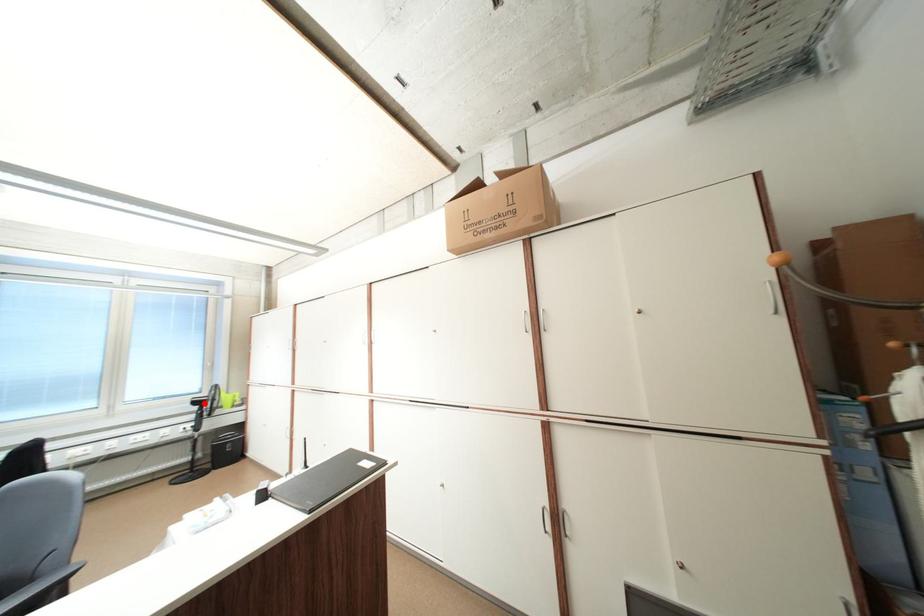
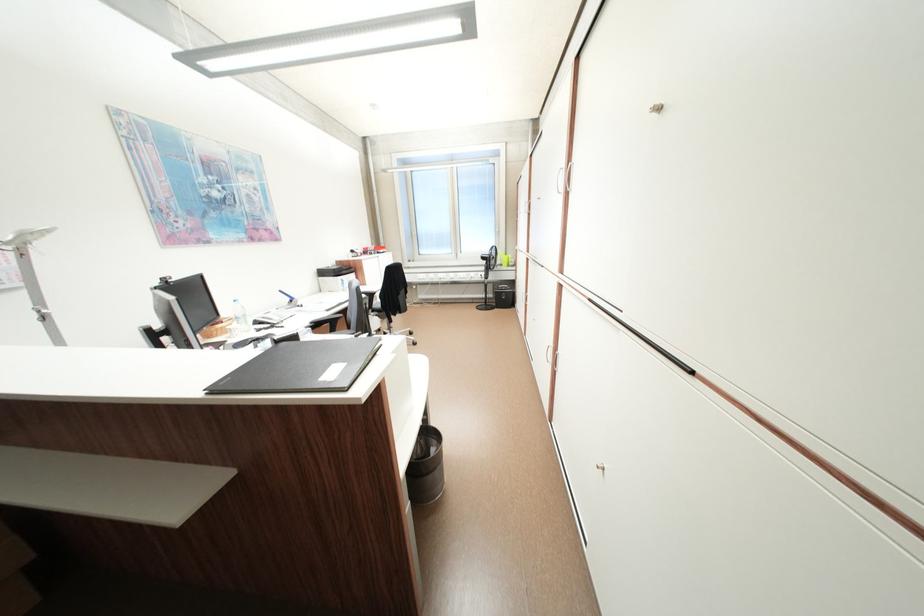
Find the pixel in the second image that matches the highlighted location in the first image.

(492, 259)